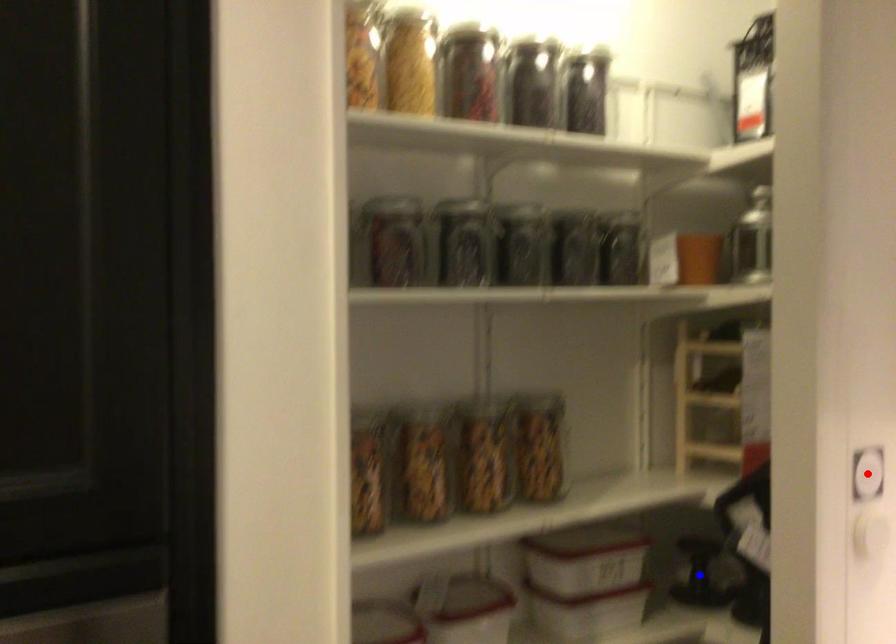
Question: Which of the two points in the image is closer to the camera?

Choices:
 (A) Blue point is closer.
 (B) Red point is closer.

Answer: (B)